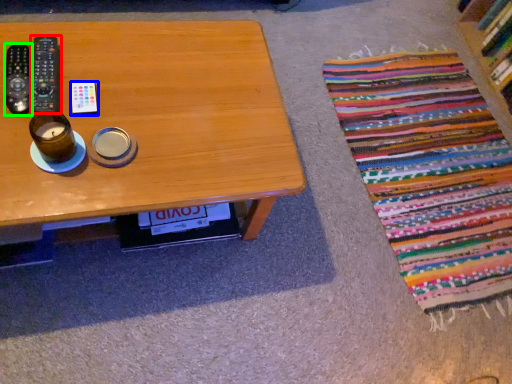
Question: Considering the real-world distances, which object is closest to remote control (highlighted by a red box)? remote control (highlighted by a blue box) or remote control (highlighted by a green box).

Choices:
 (A) remote control
 (B) remote control

Answer: (B)